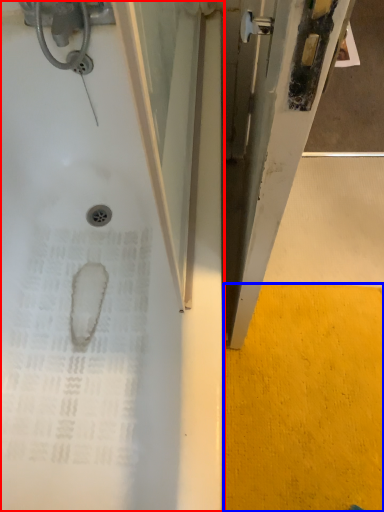
Question: Which of the following is the closest to the observer, bathtub (highlighted by a red box) or concrete (highlighted by a blue box)?

Choices:
 (A) bathtub
 (B) concrete

Answer: (A)